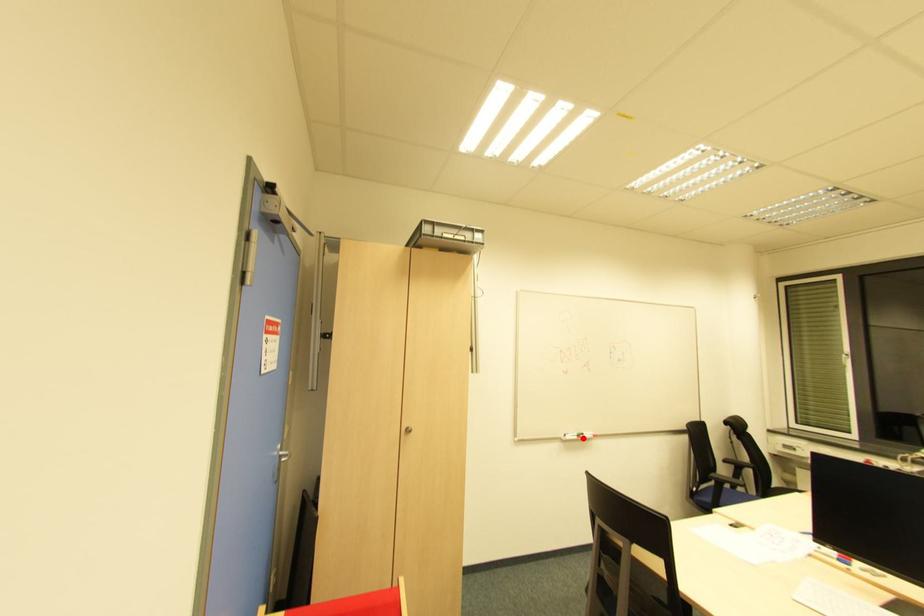
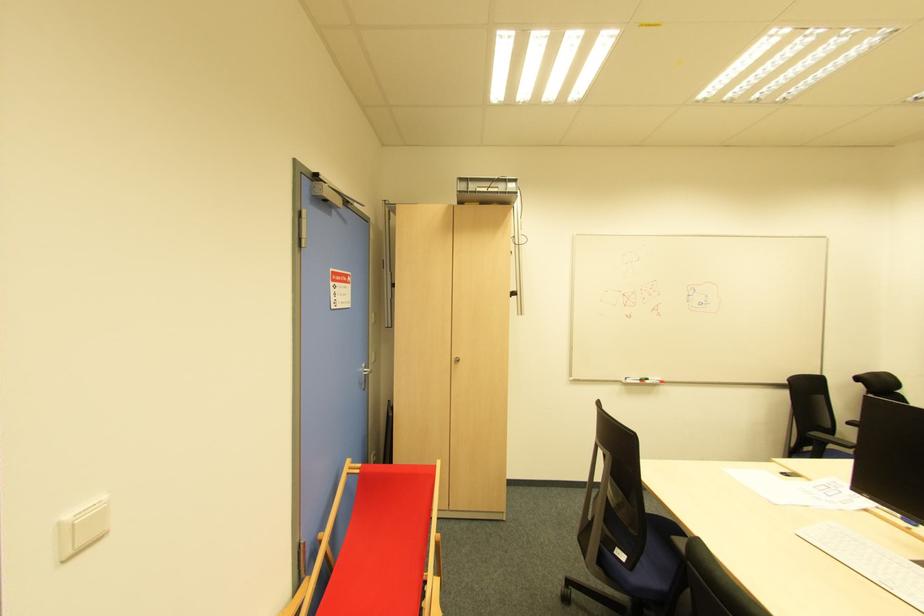
Question: I am providing you with two images of the same scene from different viewpoints. A red point is marked on the first image. Can you still see the location of the red point in image 2?

Choices:
 (A) Yes
 (B) No

Answer: (A)